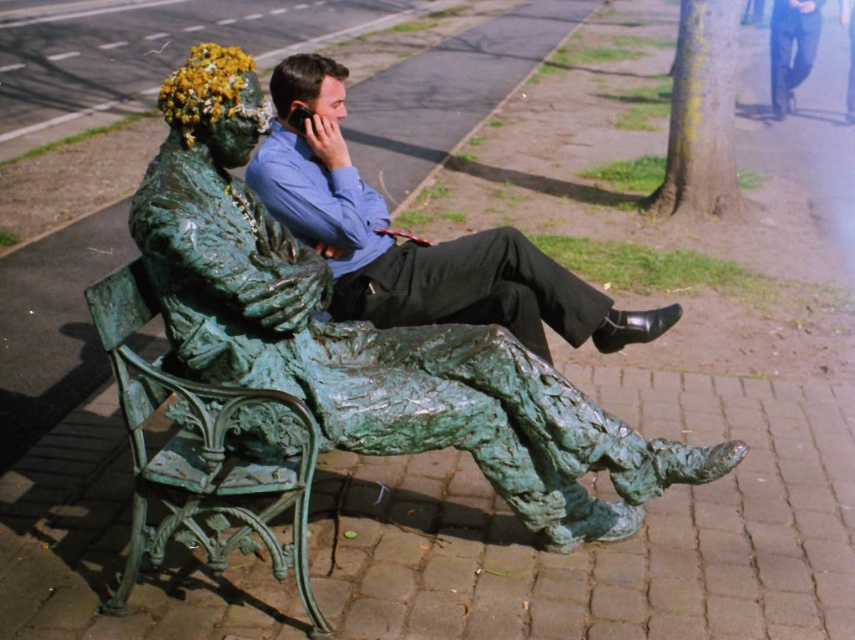
Question: Which of the following is the closest to the observer?

Choices:
 (A) matte green statue at center
 (B) green patinated bronze statue at center

Answer: (B)

Question: Which point appears closest to the camera in this image?

Choices:
 (A) (453, 362)
 (B) (391, 253)

Answer: (A)

Question: Is green patinated bronze statue at center behind matte green statue at center?

Choices:
 (A) no
 (B) yes

Answer: (A)

Question: Can you confirm if green patinated bronze statue at center is smaller than matte green statue at center?

Choices:
 (A) yes
 (B) no

Answer: (B)

Question: Which point is farther to the camera?

Choices:
 (A) (596, 298)
 (B) (175, 108)

Answer: (A)

Question: Is green patinated bronze statue at center further to camera compared to matte green statue at center?

Choices:
 (A) yes
 (B) no

Answer: (B)